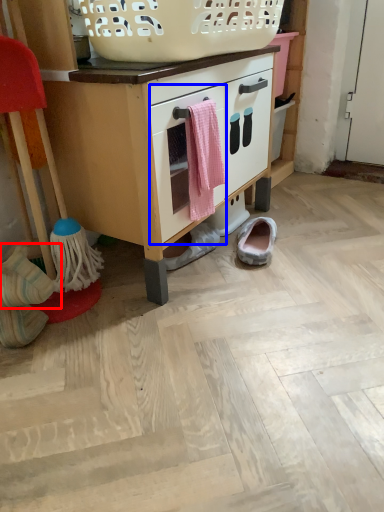
Question: Which object appears closest to the camera in this image, footwear (highlighted by a red box) or drawer (highlighted by a blue box)?

Choices:
 (A) footwear
 (B) drawer

Answer: (A)